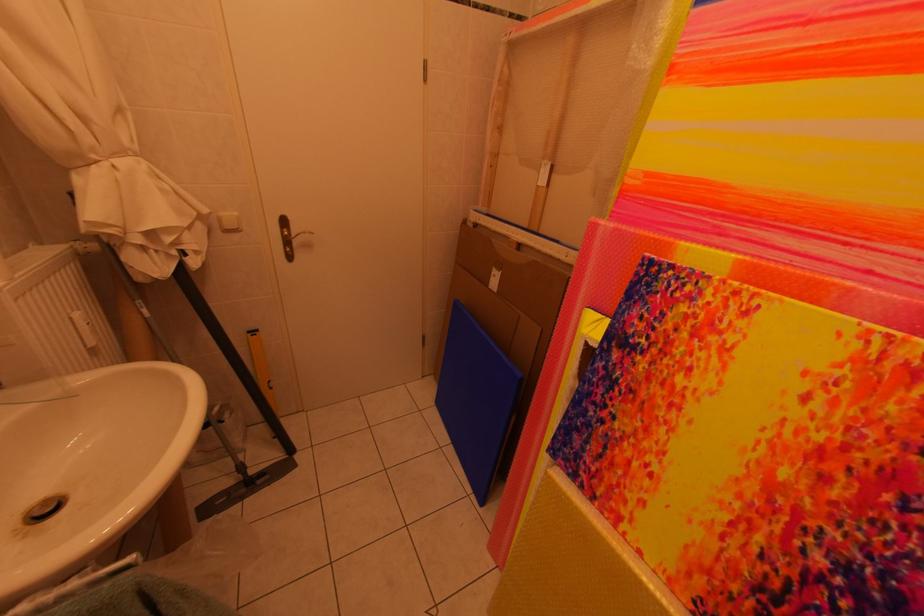
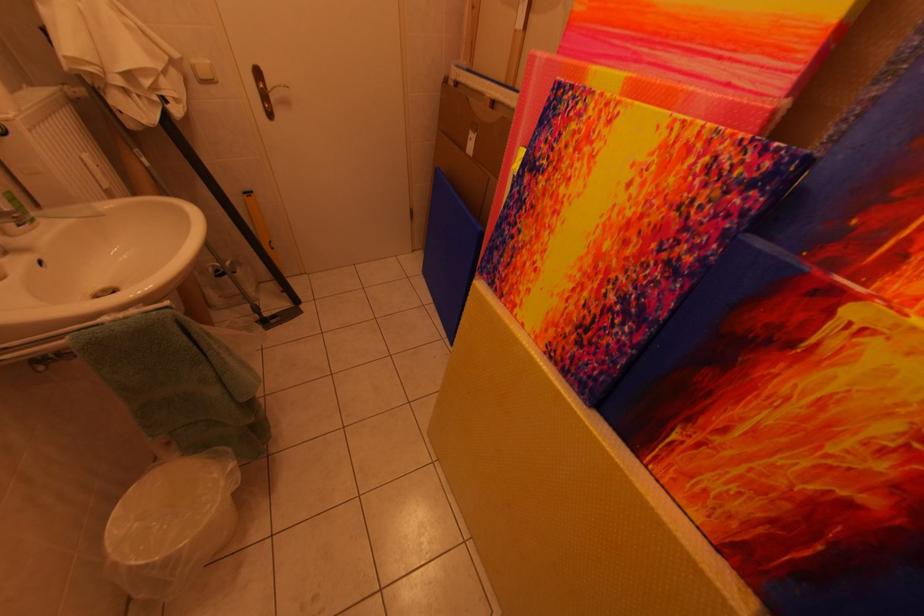
The point at (x=867, y=254) is marked in the first image. Where is the corresponding point in the second image?

(734, 68)